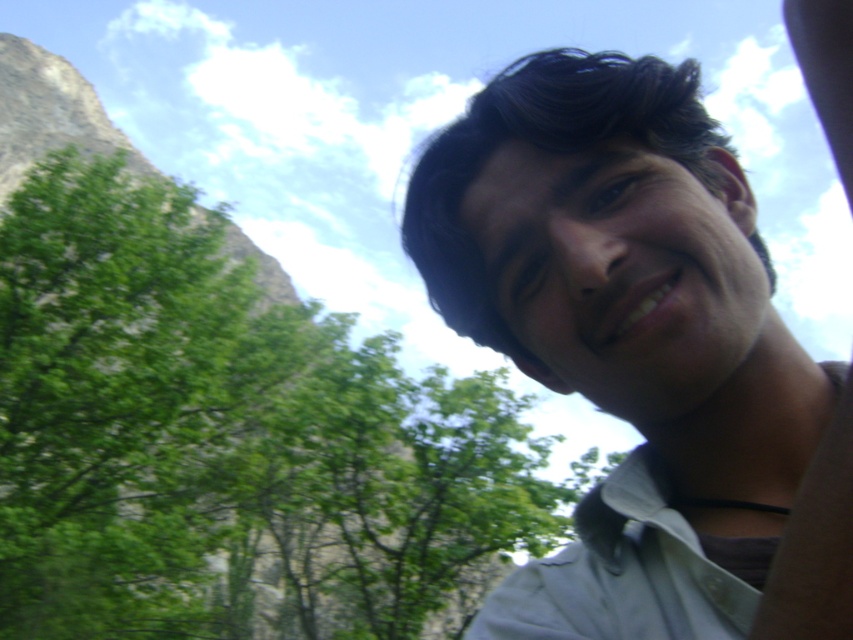
You are a photographer adjusting your camera settings. You notice the white matte shirt at upper right and the white cotton shirt at lower right in your frame. Which shirt appears taller in the photo?

The white matte shirt at upper right appears taller than the white cotton shirt at lower right in the photo.

You are a photographer adjusting your camera settings. You notice the green leafy tree at upper left and the white matte shirt at upper right in your frame. Which object is closer to your camera lens?

The green leafy tree at upper left is closer to the camera lens because it is further to the viewer than the white matte shirt at upper right.

You are standing in front of the person in the image. You notice two points marked in the scene. The first point is at coordinate point(236,620) and the second at point(692,525). Which point is closer to you?

Point(236,620) is closer to you because it is further to the viewer than point(692,525).